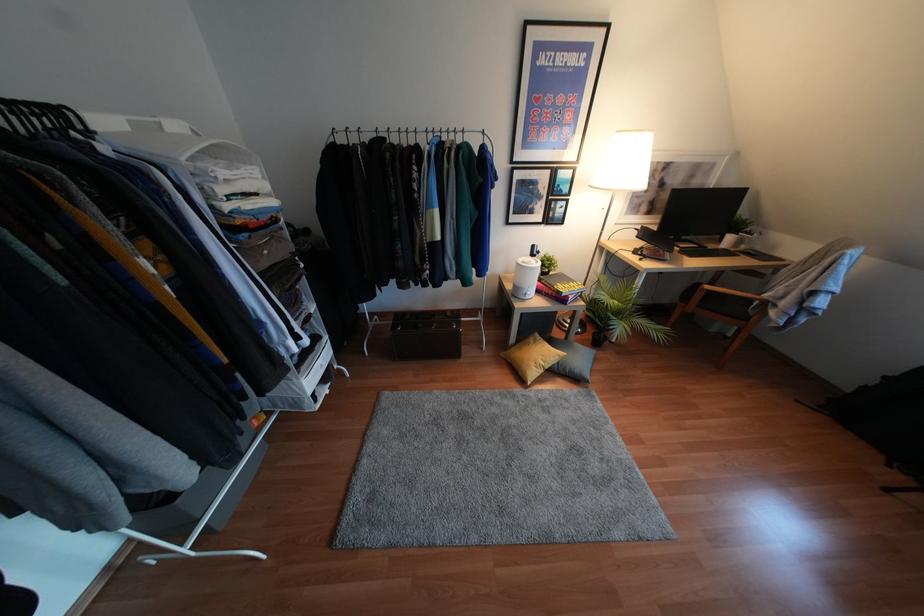
What do you see at coordinates (573, 359) in the screenshot? The height and width of the screenshot is (616, 924). I see `the grey cushion` at bounding box center [573, 359].